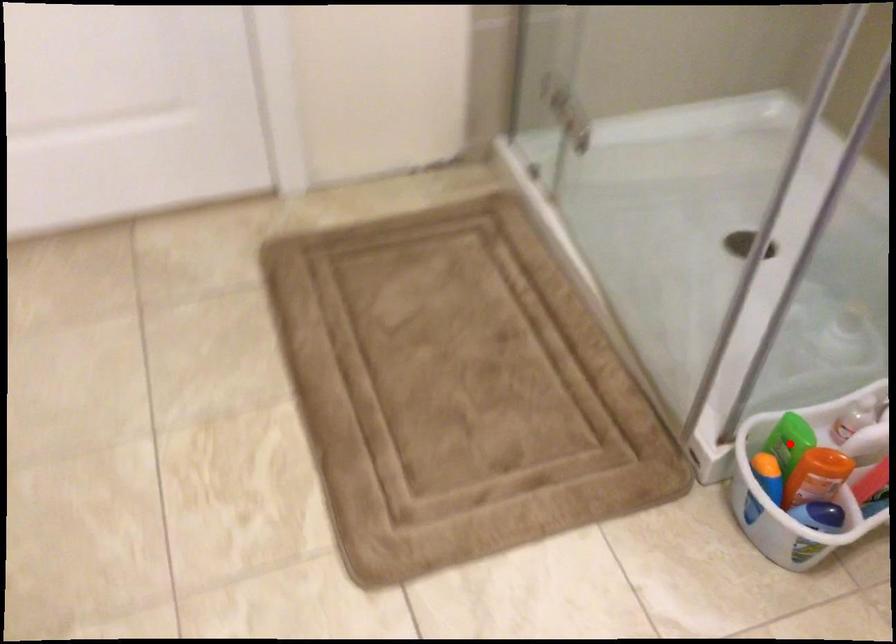
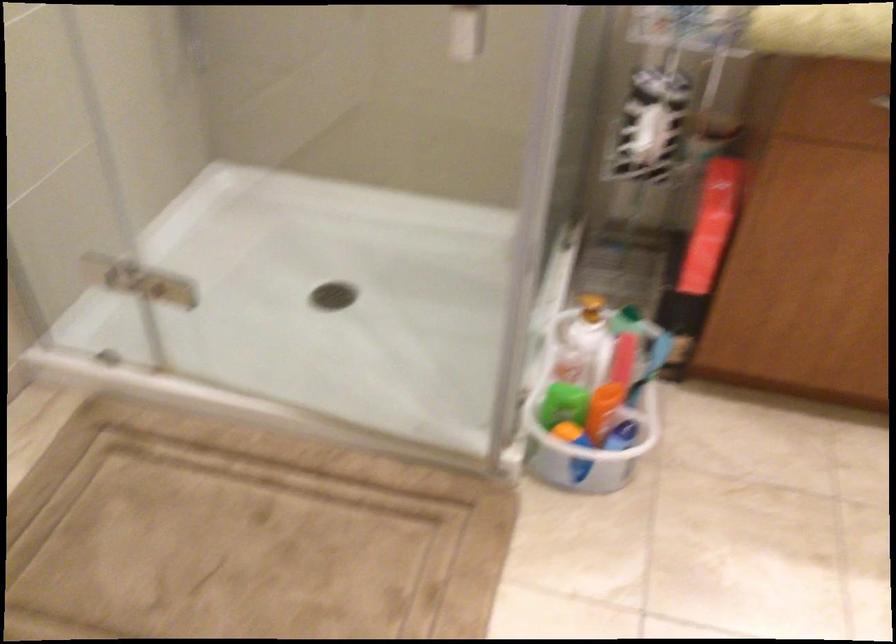
Question: I am providing you with two images of the same scene from different viewpoints. In image1, a red point is highlighted. Considering the same 3D point in image2, which of the following is correct?

Choices:
 (A) It is closer
 (B) It is farther

Answer: (B)